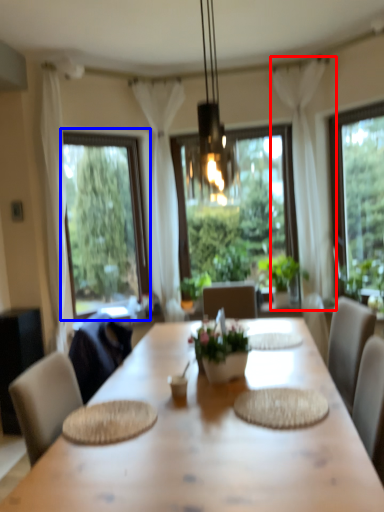
Question: Which object is further to the camera taking this photo, curtain (highlighted by a red box) or window (highlighted by a blue box)?

Choices:
 (A) curtain
 (B) window

Answer: (B)